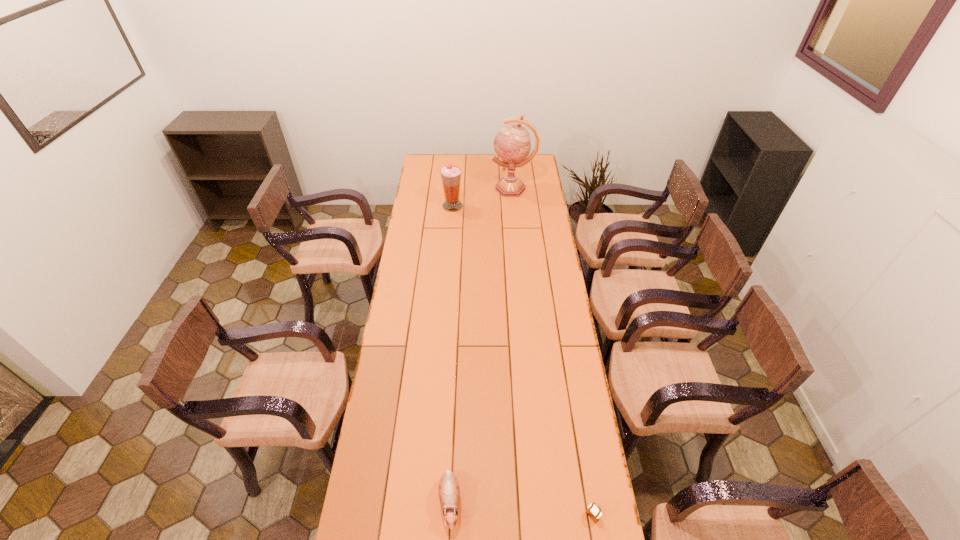
The height and width of the screenshot is (540, 960). I want to click on vacant space located on the left of the padlock, so click(530, 515).

The image size is (960, 540). I want to click on globe that is positioned at the right edge, so click(512, 144).

At what (x,y) coordinates should I click in order to perform the action: click on padlock present at the right edge. Please return your answer as a coordinate pair (x, y). The width and height of the screenshot is (960, 540). Looking at the image, I should click on (594, 513).

I want to click on free space at the far edge, so click(x=500, y=172).

This screenshot has height=540, width=960. What are the coordinates of `blank space at the left edge of the desktop` in the screenshot? It's located at (403, 267).

You are a GUI agent. You are given a task and a screenshot of the screen. Output one action in this format:
    pyautogui.click(x=<x>, y=<y>)
    Task: Click on the free region at the right edge of the desktop
    
    Given the screenshot: What is the action you would take?
    pyautogui.click(x=533, y=211)

Image resolution: width=960 pixels, height=540 pixels. In the image, there is a desktop. Identify the location of vacant space at the far left corner. (422, 158).

The width and height of the screenshot is (960, 540). Find the location of `vacant region at the far right corner of the desktop`. vacant region at the far right corner of the desktop is located at coordinates pyautogui.click(x=537, y=163).

At what (x,y) coordinates should I click in order to perform the action: click on unoccupied area between the globe and the second tallest object. Please return your answer as a coordinate pair (x, y). Image resolution: width=960 pixels, height=540 pixels. Looking at the image, I should click on (483, 197).

The height and width of the screenshot is (540, 960). Find the location of `vacant area between the hamster and the padlock`. vacant area between the hamster and the padlock is located at coordinates (521, 509).